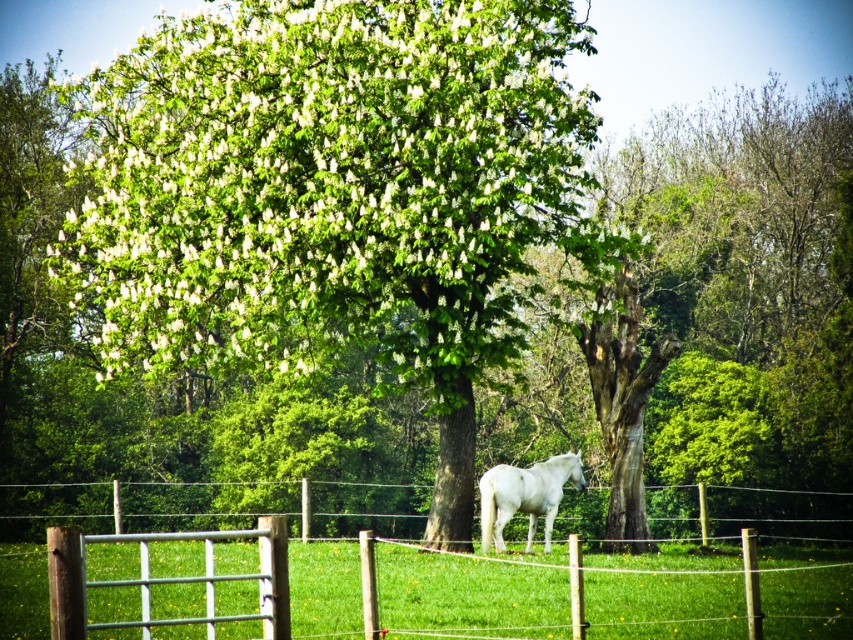
Question: Among these points, which one is farthest from the camera?

Choices:
 (A) (577, 488)
 (B) (479, 605)
 (C) (381, 13)

Answer: (A)

Question: Which of the following is the farthest from the observer?

Choices:
 (A) white glossy horse at center
 (B) green leafy tree at center

Answer: (A)

Question: Is green leafy tree at center positioned before white glossy horse at center?

Choices:
 (A) yes
 (B) no

Answer: (A)

Question: Does metal wire fence at center have a larger size compared to white glossy horse at center?

Choices:
 (A) no
 (B) yes

Answer: (B)

Question: Which point is farther from the camera taking this photo?

Choices:
 (A) (815, 627)
 (B) (456, 45)

Answer: (B)

Question: Can you confirm if metal wire fence at center is positioned below white glossy horse at center?

Choices:
 (A) yes
 (B) no

Answer: (A)